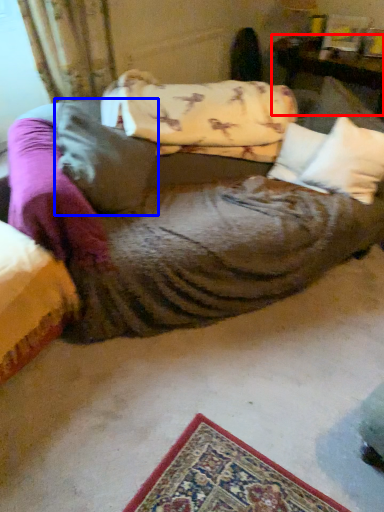
Question: Which of the following is the closest to the observer, furniture (highlighted by a red box) or pillow (highlighted by a blue box)?

Choices:
 (A) furniture
 (B) pillow

Answer: (B)